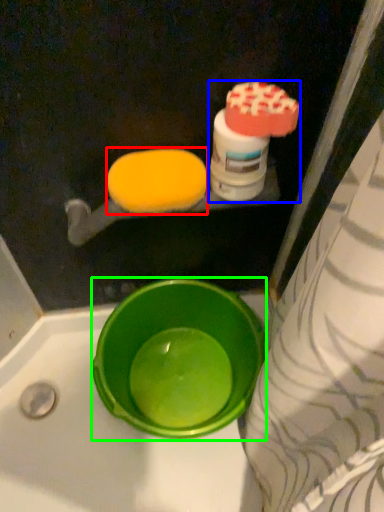
Question: Which object is positioned closest to food (highlighted by a red box)? Select from cleaning product (highlighted by a blue box) and basin (highlighted by a green box).

Choices:
 (A) cleaning product
 (B) basin

Answer: (A)